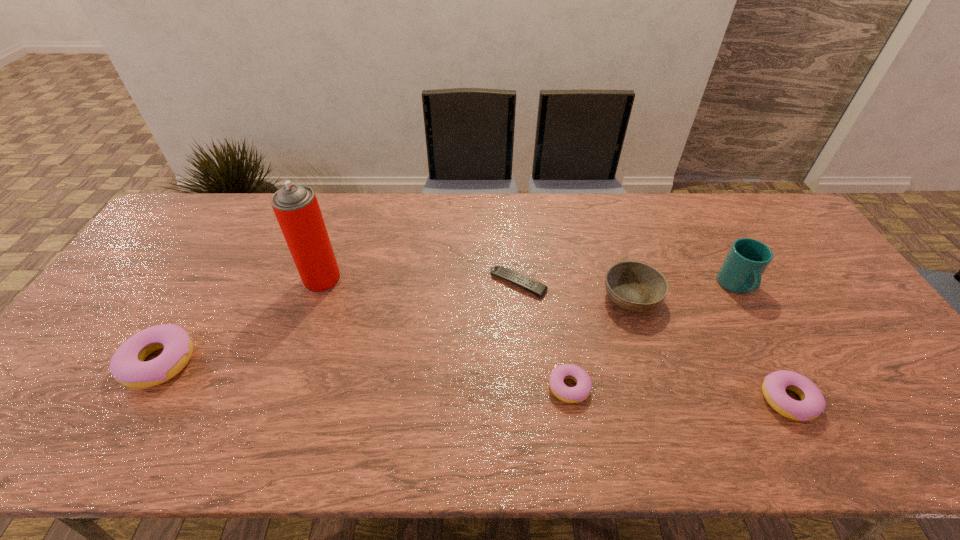
Please mark a free spot for a new doughnut to balance the arrangement. Please provide its 2D coordinates. Your answer should be formatted as a tuple, i.e. [(x, y)], where the tuple contains the x and y coordinates of a point satisfying the conditions above.

[(360, 375)]